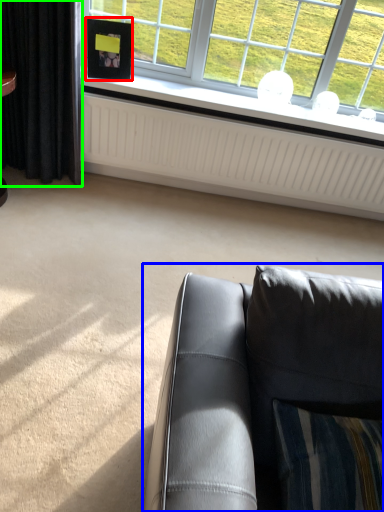
Question: Estimate the real-world distances between objects in this image. Which object is closer to picture frame (highlighted by a red box), studio couch (highlighted by a blue box) or curtain (highlighted by a green box)?

Choices:
 (A) studio couch
 (B) curtain

Answer: (B)